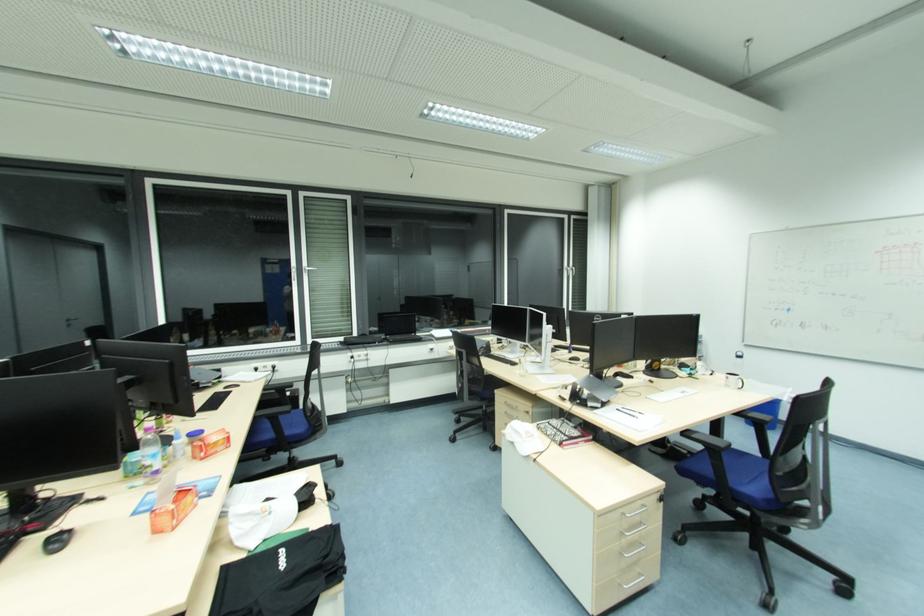
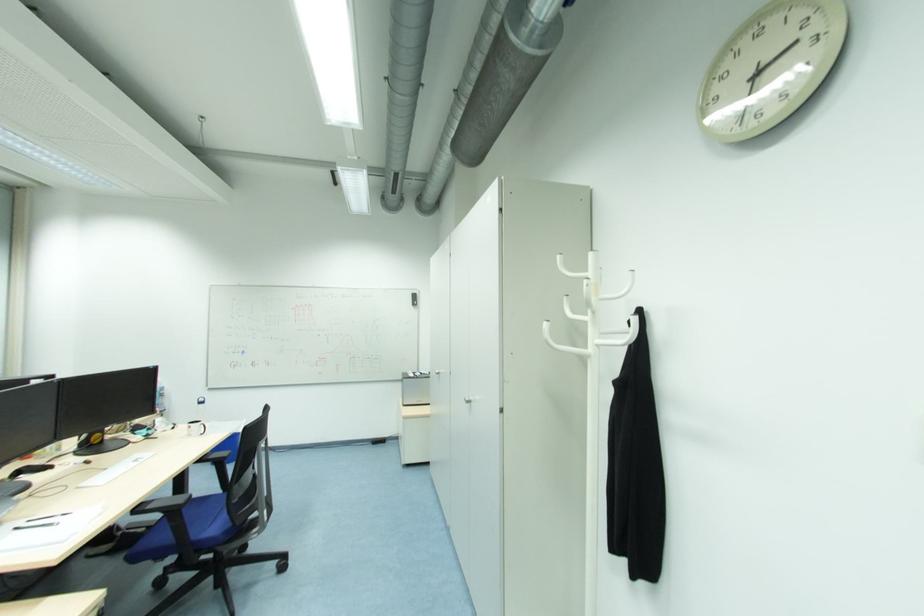
Question: How did the camera likely rotate?

Choices:
 (A) Left
 (B) Right
 (C) Up
 (D) Down

Answer: (B)